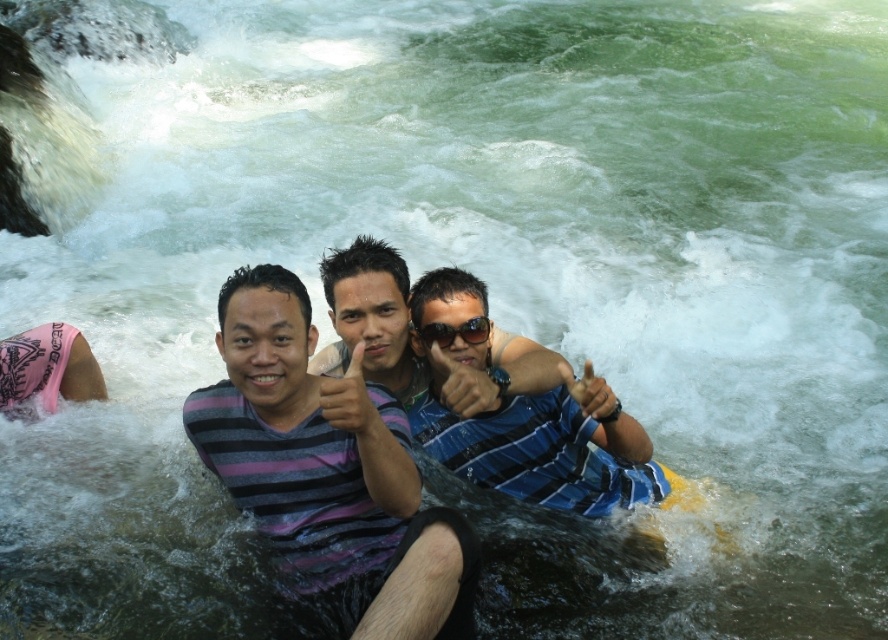
You are a photographer trying to capture a group photo of the blue striped shirt at center and the striped fabric man at center. Your camera has a minimum focus distance of 20 inches. Can you take a clear photo of both subjects without moving them?

The distance between the blue striped shirt at center and the striped fabric man at center is 20.36 inches, which is just over the camera minimum focus distance of 20 inches. Therefore, you can take a clear photo of both subjects without moving them.

You are a photographer standing on the riverbank. You want to take a photo of the striped fabric man at center and the yellow rubber at lower center. Which object is closer to the camera based on their positions?

The striped fabric man at center is positioned over the yellow rubber at lower center, meaning the striped fabric man at center is closer to the camera.